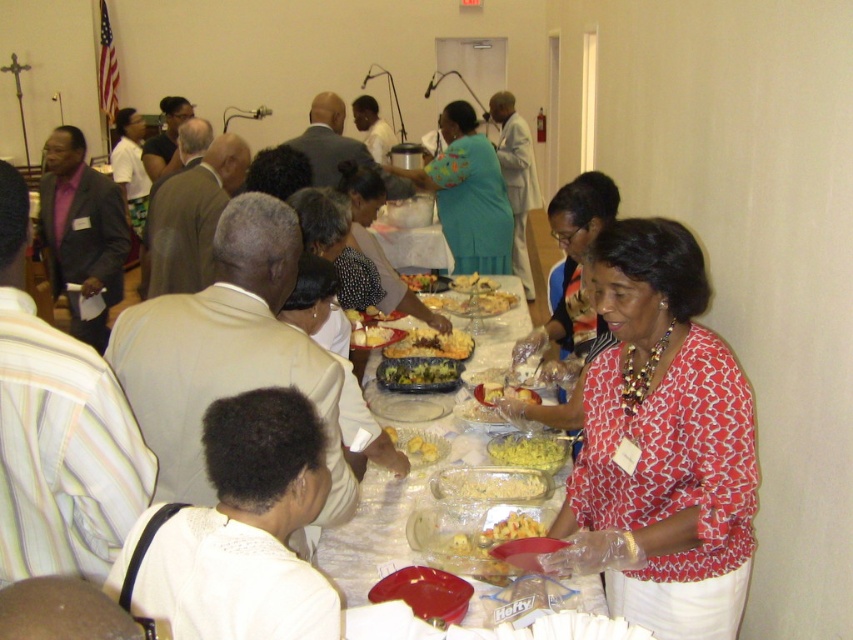
Question: Estimate the real-world distances between objects in this image. Which object is farther from the yellowish matte salad at center?

Choices:
 (A) translucent plastic table at center
 (B) yellow matte pasta at center
 (C) yellow matte salad at center
 (D) smooth yellow cake at center

Answer: (B)

Question: Estimate the real-world distances between objects in this image. Which object is closer to the translucent plastic table at center?

Choices:
 (A) printed fabric blouse at center
 (B) golden crispy fried chicken at center
 (C) yellow matte cake at center

Answer: (C)

Question: Can you confirm if printed fabric blouse at center is positioned below yellowish matte salad at center?

Choices:
 (A) no
 (B) yes

Answer: (A)

Question: Is teal fabric dress at center above smooth yellow cake at center?

Choices:
 (A) yes
 (B) no

Answer: (A)

Question: Is yellow matte pasta at center above yellowish matte salad at center?

Choices:
 (A) no
 (B) yes

Answer: (A)

Question: Based on their relative distances, which object is farther from the translucent plastic table at center?

Choices:
 (A) yellow matte pasta at center
 (B) polka dot blouse at center
 (C) translucent plastic container at center
 (D) yellow/golden textured pasta at center

Answer: (B)